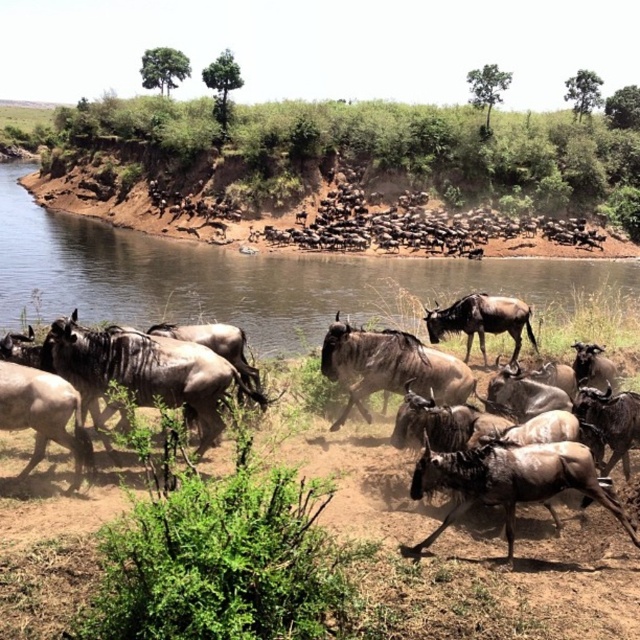
You are a photographer standing at the edge of the river in the savanna scene. You want to take a photo that includes both the point at coordinates (332, 576) and the point at (76, 196). Which point will appear larger in your photo?

Point at coordinates (332, 576) will appear larger in the photo because it is closer to the camera than point at coordinates (76, 196).

You are a wildebeest standing on the brown sandy dirt field at center. You want to reach the brown dirt river at upper center to drink water. Which direction should you move to get there?

The brown sandy dirt field at center is in front of the brown dirt river at upper center, so you should move forward towards the river to reach it.

You are a small bird flying over the savanna and want to land on the brown dirt river at upper center. However, you notice there is also brown dirt at upper center. Which one is lower to the ground so you can safely land?

The brown dirt river at upper center has a lesser height compared to brown dirt at upper center, so it is lower to the ground and safer for landing.